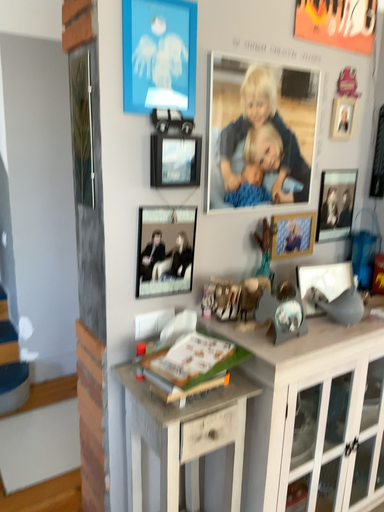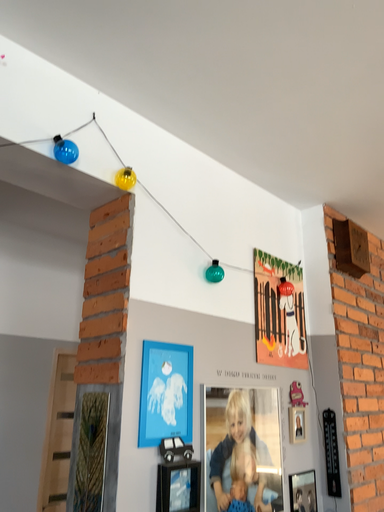
Question: Which way did the camera rotate in the video?

Choices:
 (A) rotated downward
 (B) rotated upward

Answer: (B)